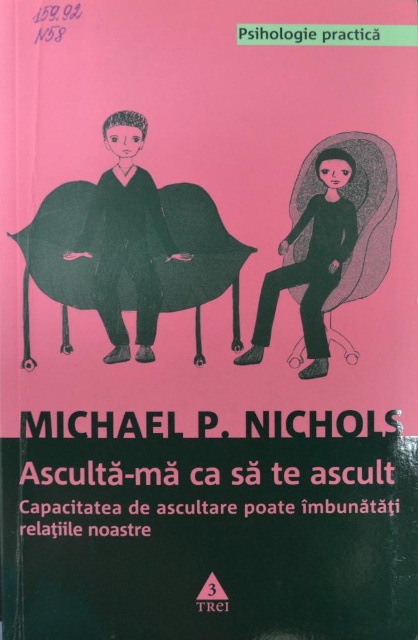
Who is more distant from viewer, (310, 458) or (331, 298)?

The point (331, 298) is behind.

Who is higher up, white paper at center or matte black blanket at center?

matte black blanket at center

Is point (168, 468) positioned in front of point (354, 280)?

Yes.

Image resolution: width=418 pixels, height=640 pixels. What are the coordinates of `white paper at center` in the screenshot? It's located at (206, 472).

Based on the photo, between black matte figure at center and matte black blanket at center, which one appears on the right side from the viewer's perspective?

matte black blanket at center is more to the right.

Is point (303, 378) behind point (369, 208)?

Yes, it is.

What are the coordinates of `black matte figure at center` in the screenshot? It's located at (311, 264).

Does black matte blanket at center appear on the left side of matte black suit at center?

In fact, black matte blanket at center is to the right of matte black suit at center.

Who is shorter, black matte blanket at center or matte black suit at center?

black matte blanket at center is shorter.

Describe the element at coordinates (196, 250) in the screenshot. The width and height of the screenshot is (418, 640). I see `black matte blanket at center` at that location.

Find the location of a particular element. The image size is (418, 640). black matte blanket at center is located at coordinates (196, 250).